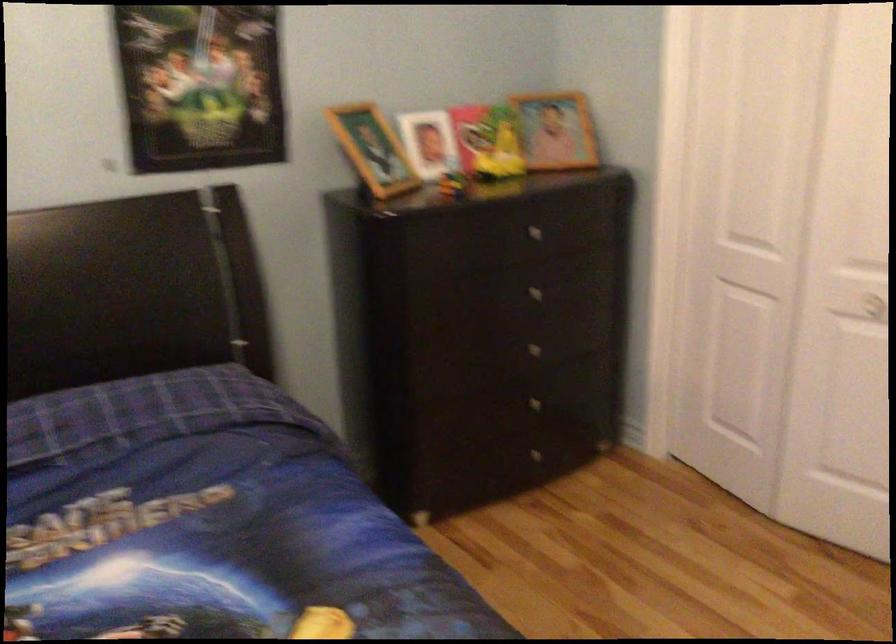
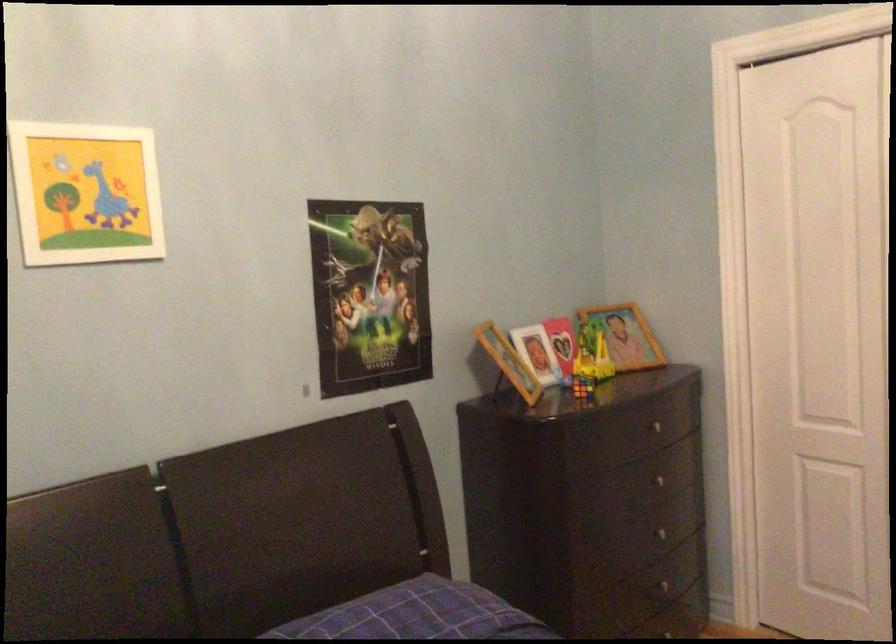
Question: What movement of the cameraman would produce the second image?

Choices:
 (A) Left
 (B) Right
 (C) Forward
 (D) Backward

Answer: (A)